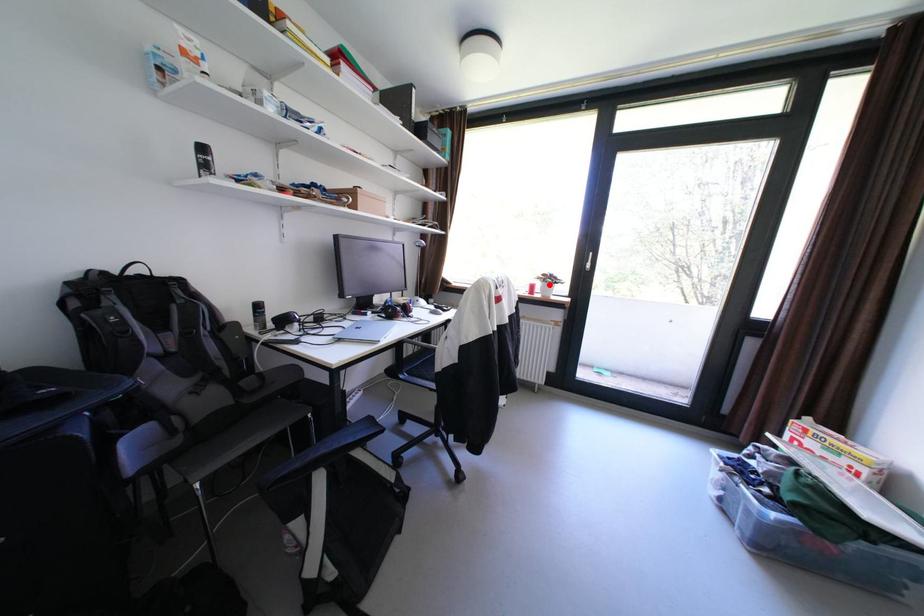
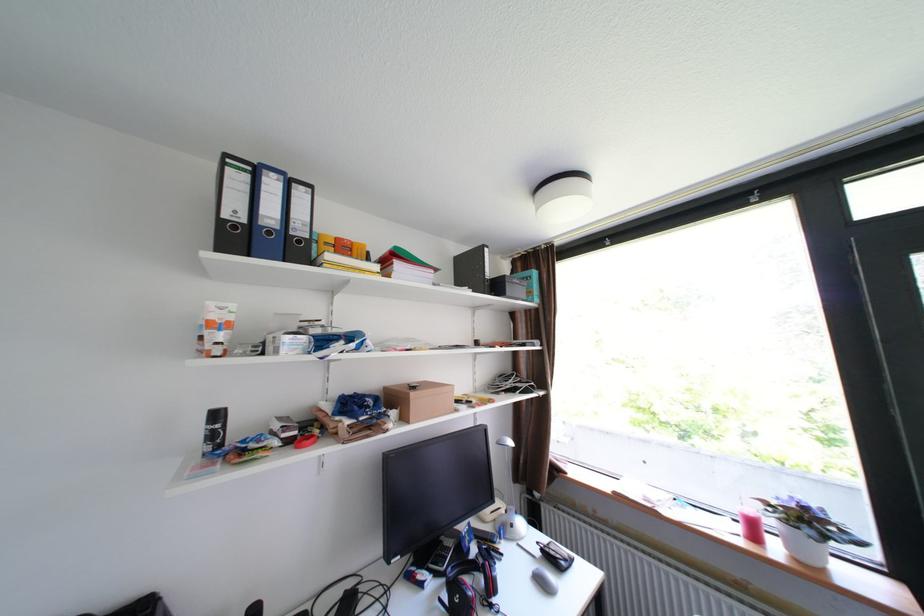
Find the pixel in the second image that matches the highlighted location in the first image.

(782, 523)